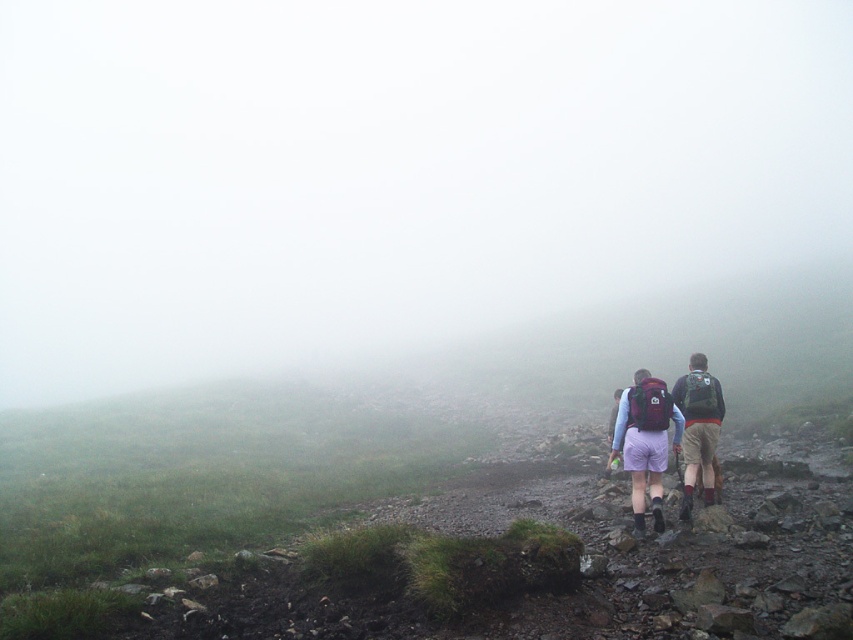
You are a hiker trying to locate your friend who is wearing matte purple shorts at center in a foggy landscape. Based on the coordinates provided, where should you look to find them?

The matte purple shorts at center are located at point 0.667 on the x axis and 0.818 on the y axis, so you should look towards that coordinate to find your friend.

In the scene shown: You are a hiker planning to cross the rocky path in the misty landscape. You see the matte purple shorts at center and the dark green backpack at right. Which item would be easier to see through the fog, and why?

The matte purple shorts at center would be easier to see through the fog because they are thinner and more visible compared to the dark green backpack at right, which is thicker and might blend into the surroundings.